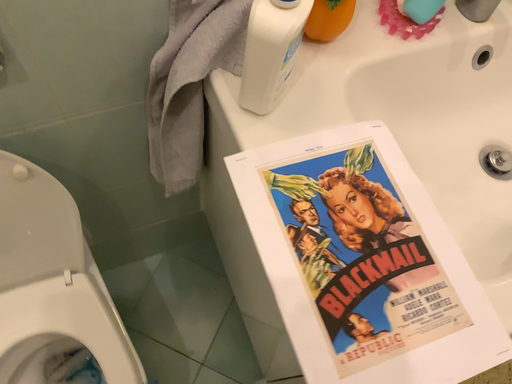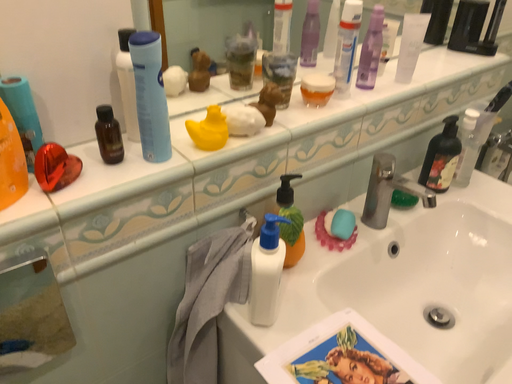
Question: How did the camera likely rotate when shooting the video?

Choices:
 (A) rotated downward
 (B) rotated upward

Answer: (B)